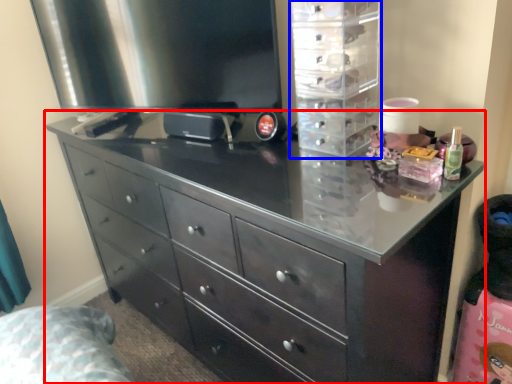
Question: Which of the following is the closest to the observer, chest of drawers (highlighted by a red box) or cabinet (highlighted by a blue box)?

Choices:
 (A) chest of drawers
 (B) cabinet

Answer: (A)